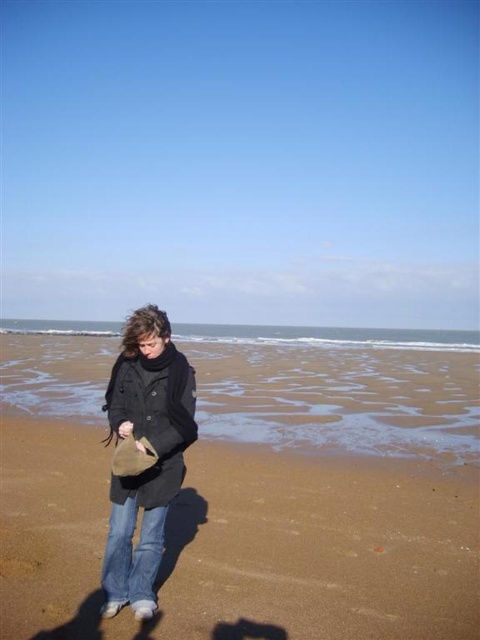
You are standing on the beach and want to reach the point marked at coordinates point (6, 397). If you can walk 3 feet per second, how many seconds will it take you to reach that point?

The distance between you and the point (6, 397) is 49.07 feet. At a walking speed of 3 feet per second, it will take approximately 16.36 seconds to reach the point.

You are a photographer trying to capture the dark gray wool coat at center in your shot. The camera you are using has a focal length of 50mm and an aperture of f2.8. To ensure the coat is in focus, what should you adjust if the coat appears blurry?

The position of dark gray wool coat at center is at point (144, 456), so you should adjust the focus ring to ensure the coat is sharp. Alternatively, you might consider using a smaller aperture for a deeper depth of field, but since the aperture is already f2.8, adjusting the focus ring to the correct distance is more effective.